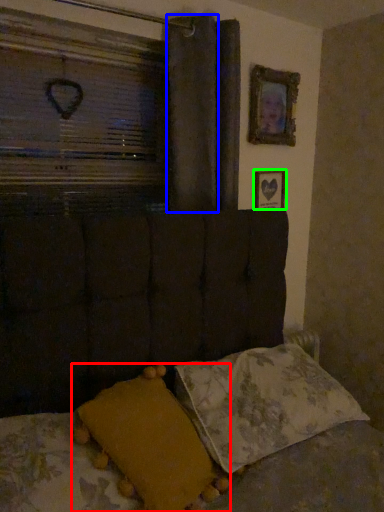
Question: Which is farther away from pillow (highlighted by a red box)? curtain (highlighted by a blue box) or picture frame (highlighted by a green box)?

Choices:
 (A) curtain
 (B) picture frame

Answer: (B)